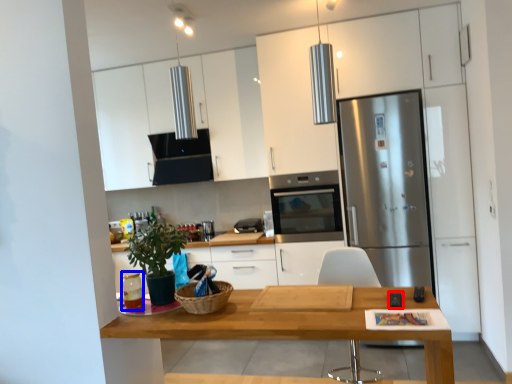
Question: Which object is closer to the camera taking this photo, appliance (highlighted by a red box) or appliance (highlighted by a blue box)?

Choices:
 (A) appliance
 (B) appliance

Answer: (A)